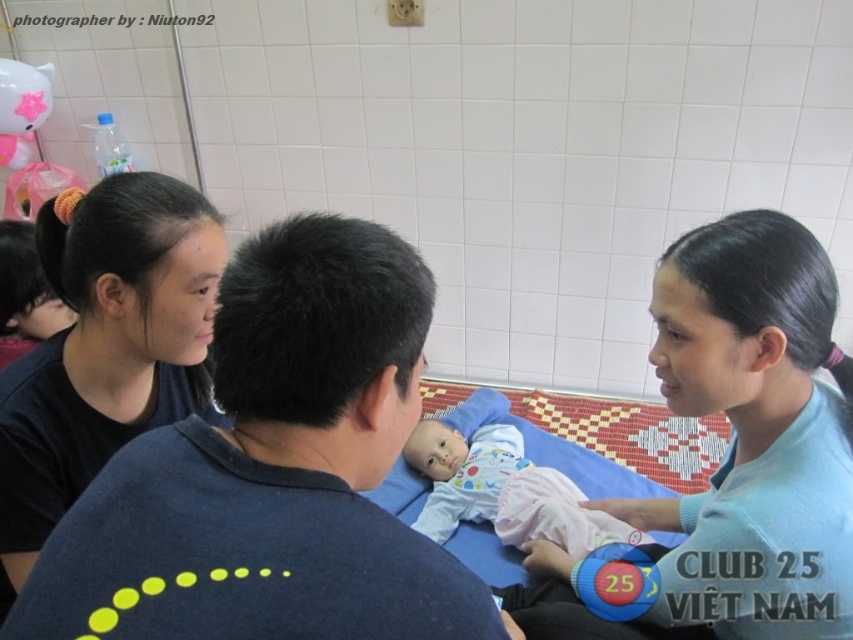
Question: Is black matte hair at upper left below light pink fabric baby at center?

Choices:
 (A) yes
 (B) no

Answer: (B)

Question: From the image, what is the correct spatial relationship of dark blue t-shirt at center in relation to black matte hair at upper left?

Choices:
 (A) left
 (B) right

Answer: (B)

Question: From the image, what is the correct spatial relationship of dark blue t-shirt at center in relation to light pink fabric baby at center?

Choices:
 (A) above
 (B) below

Answer: (A)

Question: Which point appears farthest from the camera in this image?

Choices:
 (A) (19, 541)
 (B) (427, 524)

Answer: (B)

Question: Which object is closer to the camera taking this photo?

Choices:
 (A) light blue fabric at right
 (B) light pink fabric baby at center
 (C) dark blue t-shirt at center

Answer: (C)

Question: Among these objects, which one is nearest to the camera?

Choices:
 (A) light pink fabric baby at center
 (B) light blue fabric at right
 (C) dark blue t-shirt at center

Answer: (C)